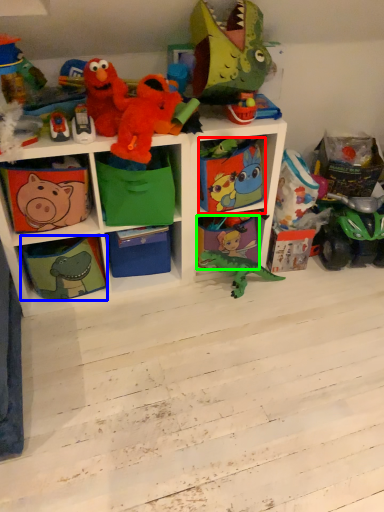
Question: Considering the real-world distances, which object is farthest from box (highlighted by a red box)? shelf (highlighted by a blue box) or shelf (highlighted by a green box)?

Choices:
 (A) shelf
 (B) shelf

Answer: (A)